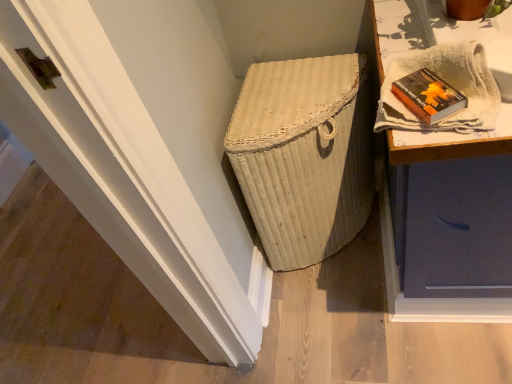
At what (x,y) coordinates should I click in order to perform the action: click on free space above white wicker basket at center (from a real-world perspective). Please return your answer as a coordinate pair (x, y). Looking at the image, I should click on (298, 88).